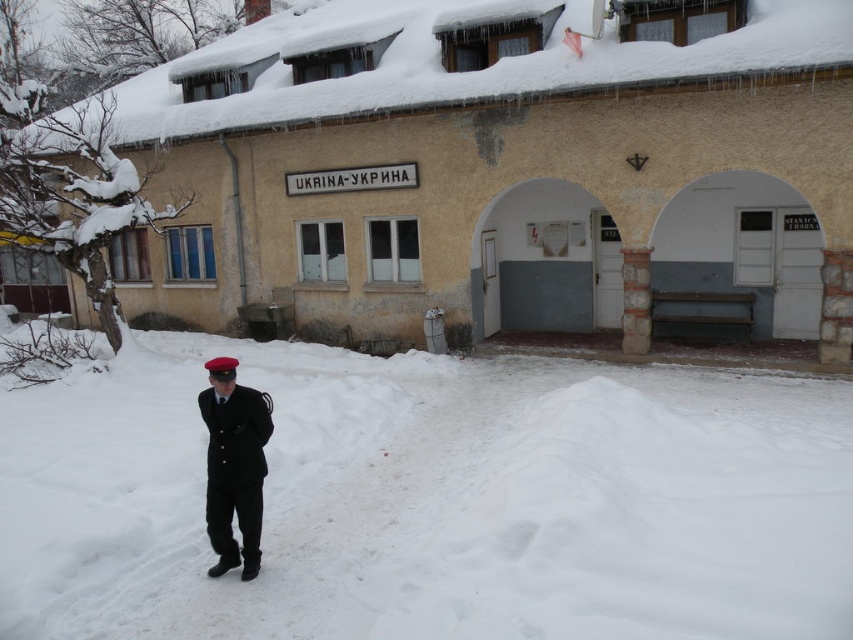
You are a photographer trying to capture a clear shot of the UKRAINA building. You notice the white fluffy snow at lower center and the black matte uniform at lower left in your frame. Which object is positioned closer to your camera lens?

The white fluffy snow at lower center is closer to the viewer than the black matte uniform at lower left, so it would appear closer to the camera lens.

You are a photographer setting up a shot of the UKRAINA building. You need to place a tripod between the white fluffy snow at lower center and the black matte uniform at lower left. The tripod requires at least 2 meters of space. Can you fit it there?

The distance between the white fluffy snow at lower center and the black matte uniform at lower left is 2.65 meters, which is more than the required 2 meters. Therefore, the tripod can be placed there with sufficient space.